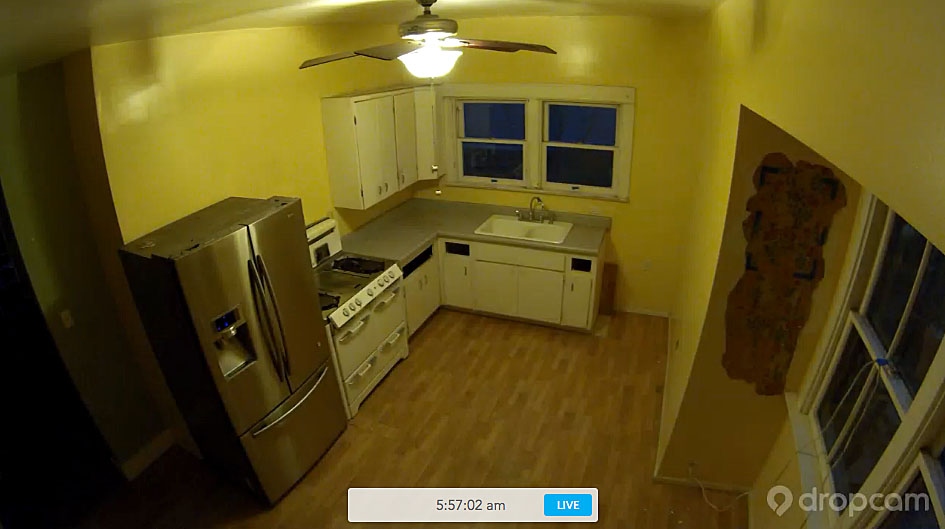
Where is `stove`? This screenshot has width=945, height=529. stove is located at coordinates (353, 268).